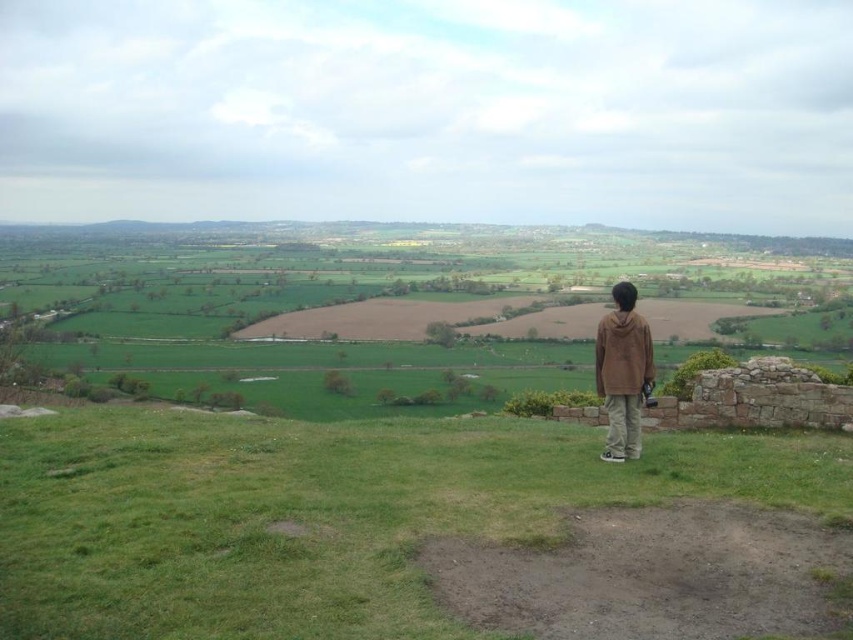
Between green grassy at center and brown cotton hoodie at center, which one is positioned lower?

green grassy at center is below.

Looking at this image, which of these two, green grassy at center or brown cotton hoodie at center, stands taller?

Standing taller between the two is brown cotton hoodie at center.

I want to click on green grassy at center, so click(x=318, y=515).

Where is `green grassy at center`? Image resolution: width=853 pixels, height=640 pixels. green grassy at center is located at coordinates (318, 515).